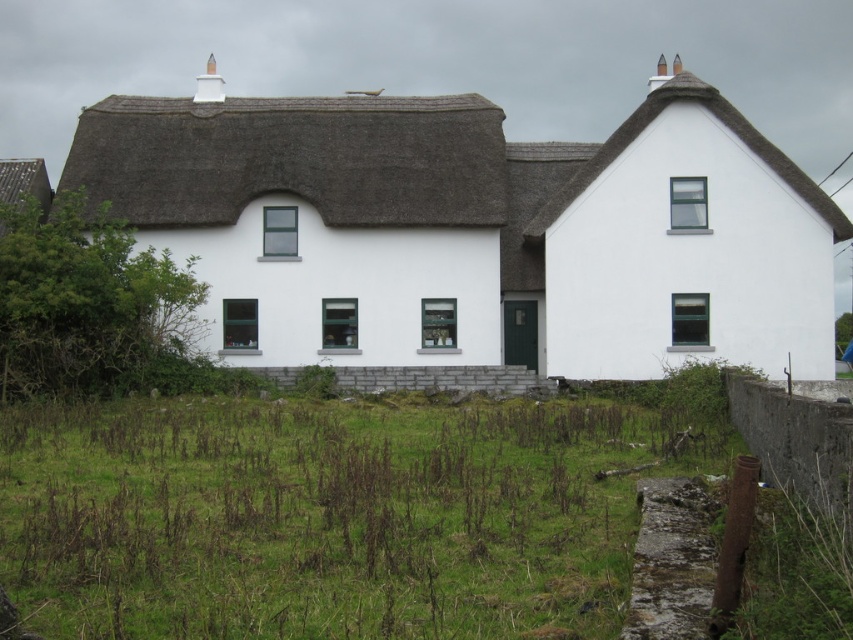
You are standing in front of the white thatched roof cottage at center and want to look up at the thatched roof at upper right. Which direction should you turn your head to see it?

The white thatched roof cottage at center is below the thatched roof at upper right, so you should look upward to see the thatched roof at upper right.

You are a painter standing in front of the white thatched roof cottage at center and the thatched roof at upper right. You want to paint both roofs but need to know which one is taller. Based on the scene, can you determine which roof is taller?

The white thatched roof cottage at center has a greater height compared to the thatched roof at upper right, so the white thatched roof cottage at center is taller.

You are standing in front of the white thatched roof cottage at center and looking down at the green grass at lower center. Which object takes up more space in the image?

The white thatched roof cottage at center is bigger than the green grass at lower center, so it takes up more space in the image.